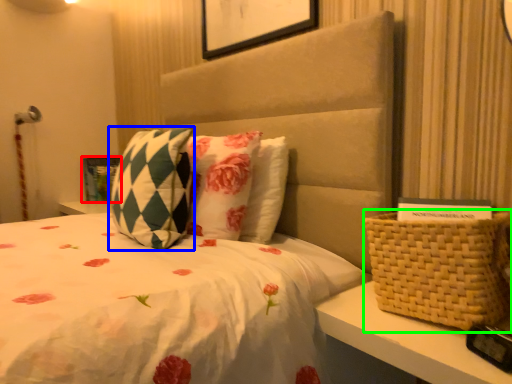
Question: Based on their relative distances, which object is farther from picture frame (highlighted by a red box)? Choose from pillow (highlighted by a blue box) and basket (highlighted by a green box).

Choices:
 (A) pillow
 (B) basket

Answer: (B)